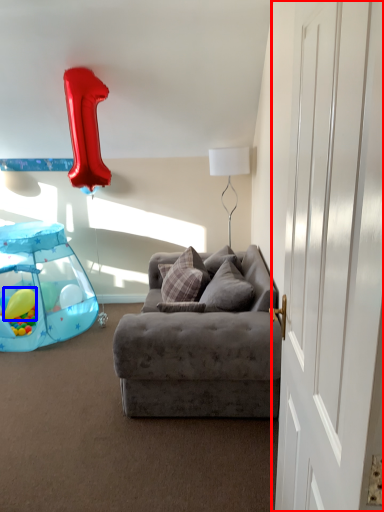
Question: Which object is further to the camera taking this photo, door (highlighted by a red box) or balloon (highlighted by a blue box)?

Choices:
 (A) door
 (B) balloon

Answer: (B)